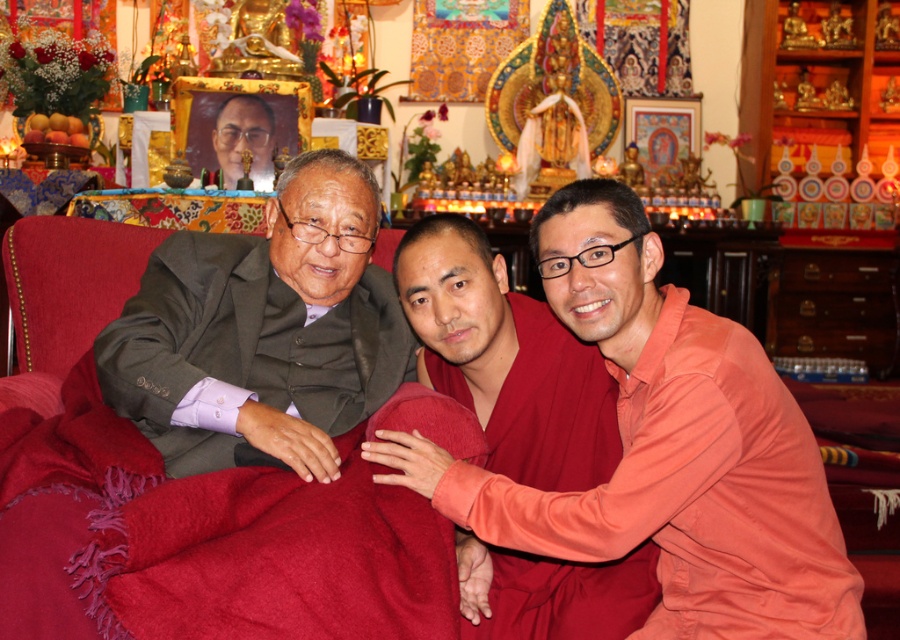
In the temple scene, there is a smooth orange robe at right. Where exactly is it located in terms of coordinates?

The smooth orange robe at right is located at point coordinates of (694,493).

You are standing in front of the temple scene and want to locate the gray suit at left. Can you tell me its exact position in the image using coordinates?

The gray suit at left is located at coordinates point (x=263, y=330).

You are standing at the point marked by the coordinate point at [403,365]. You want to walk to the entrance of the temple, which is 14.72 meters away. Is the entrance located in the direction of the background or the foreground of the image?

The entrance is located in the direction of the background because the distance from the point at [403,365] to the entrance is 14.72 meters, which is a significant distance, implying it is further away towards the background.